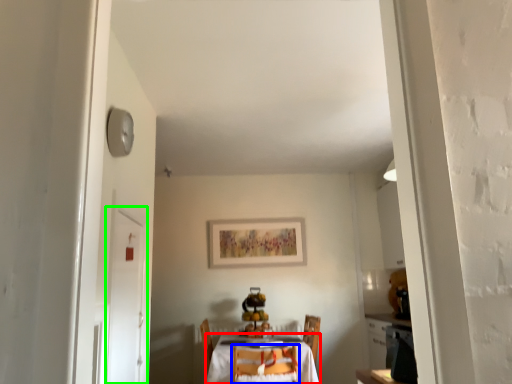
Question: Which is farther away from table (highlighted by a red box)? chair (highlighted by a blue box) or door (highlighted by a green box)?

Choices:
 (A) chair
 (B) door

Answer: (B)